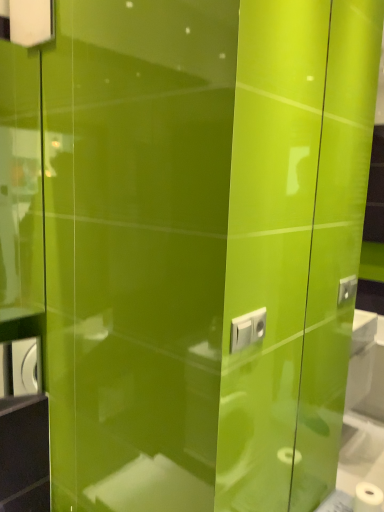
This screenshot has width=384, height=512. Describe the element at coordinates (247, 329) in the screenshot. I see `satin silver outlet at center` at that location.

I want to click on satin silver outlet at center, so click(x=247, y=329).

The image size is (384, 512). Identify the location of satin silver outlet at center. (247, 329).